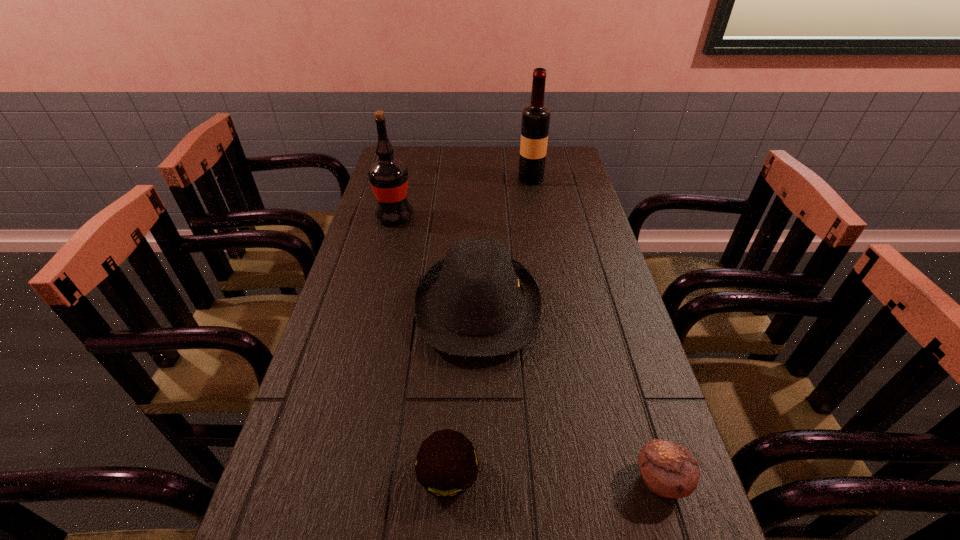
Locate an element on the screen. This screenshot has width=960, height=540. the farthest object is located at coordinates (535, 117).

This screenshot has width=960, height=540. What are the coordinates of `the farther wine bottle` in the screenshot? It's located at (535, 117).

In order to click on the second farthest object in this screenshot , I will do `click(388, 176)`.

Where is `the left wine bottle`? This screenshot has height=540, width=960. the left wine bottle is located at coordinates (388, 176).

Identify the location of fedora. This screenshot has width=960, height=540. pyautogui.click(x=478, y=301).

At what (x,y) coordinates should I click in order to perform the action: click on the third shortest object. Please return your answer as a coordinate pair (x, y). Image resolution: width=960 pixels, height=540 pixels. Looking at the image, I should click on (478, 301).

Image resolution: width=960 pixels, height=540 pixels. What are the coordinates of `patty` in the screenshot? It's located at (446, 465).

What are the coordinates of `the rightmost object` in the screenshot? It's located at (668, 469).

Image resolution: width=960 pixels, height=540 pixels. Identify the location of free location located on the front of the right wine bottle. (539, 227).

Image resolution: width=960 pixels, height=540 pixels. Identify the location of blank area located 0.290m on the front of the nearer wine bottle. (375, 292).